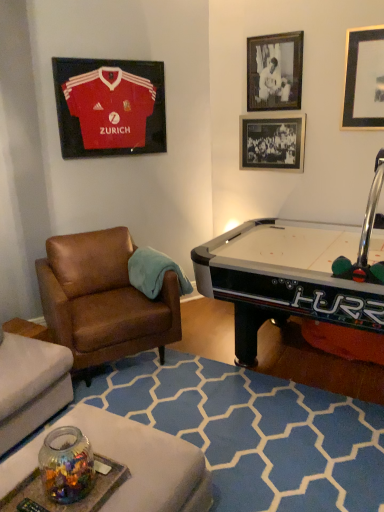
Question: Relative to black matte picture frame at upper right, marked as the 4th picture frame in a left-to-right arrangement, is black glass picture frame at upper right, placed as the 3th picture frame when sorted from left to right, in front or behind?

Choices:
 (A) behind
 (B) front

Answer: (A)

Question: Considering the positions of black glass picture frame at upper right, placed as the 3th picture frame when sorted from left to right, and black matte picture frame at upper right, marked as the 4th picture frame in a left-to-right arrangement, in the image, is black glass picture frame at upper right, placed as the 3th picture frame when sorted from left to right, taller or shorter than black matte picture frame at upper right, marked as the 4th picture frame in a left-to-right arrangement,?

Choices:
 (A) tall
 (B) short

Answer: (B)

Question: Estimate the real-world distances between objects in this image. Which object is farther from the black glass picture frame at upper right, the 2th picture frame from the right?

Choices:
 (A) brown leather chair at left
 (B) black matte picture frame at upper right, arranged as the 3th picture frame when viewed from the right
 (C) matte jersey at upper left, arranged as the fourth picture frame when viewed from the right
 (D) black matte picture frame at upper right, which appears as the first picture frame when viewed from the right

Answer: (A)

Question: Considering the real-world distances, which object is closest to the black matte picture frame at upper right, marked as the 4th picture frame in a left-to-right arrangement?

Choices:
 (A) black glass picture frame at upper right, the 2th picture frame from the right
 (B) black matte picture frame at upper right, the 2th picture frame viewed from the left
 (C) matte jersey at upper left, positioned as the 1th picture frame in left-to-right order
 (D) brown leather chair at left

Answer: (B)